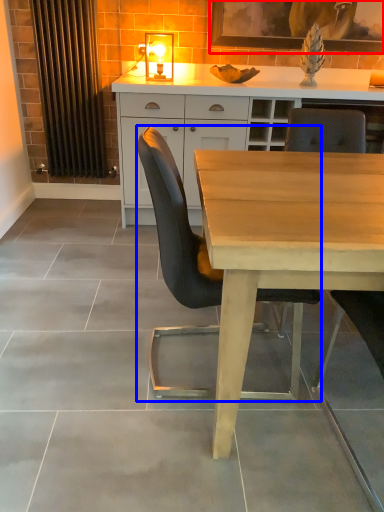
Question: Which object appears farthest to the camera in this image, picture frame (highlighted by a red box) or chair (highlighted by a blue box)?

Choices:
 (A) picture frame
 (B) chair

Answer: (A)